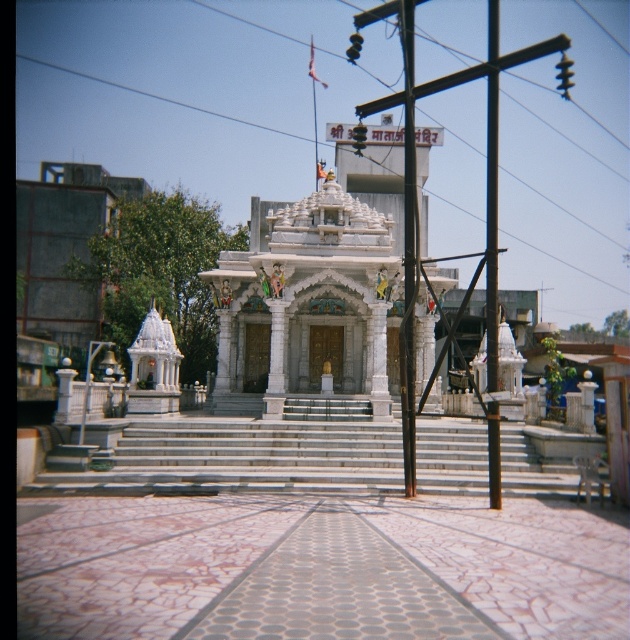
Between black metallic pole at center and metallic pole at center, which one appears on the left side from the viewer's perspective?

black metallic pole at center

Looking at this image, measure the distance between point [410,412] and camera.

Point [410,412] is 236.82 feet away from camera.

This screenshot has height=640, width=630. In order to click on black metallic pole at center in this screenshot , I will do point(408,248).

Who is positioned more to the left, white marble stairs at center or metallic pole at center?

white marble stairs at center is more to the left.

Does white marble stairs at center have a greater width compared to metallic pole at center?

Indeed, white marble stairs at center has a greater width compared to metallic pole at center.

Between point (147, 417) and point (493, 218), which one is positioned in front?

Positioned in front is point (493, 218).

Locate an element on the screen. white marble stairs at center is located at coordinates (238, 458).

Can you confirm if white marble hindu temple at center is bigger than black metallic pole at center?

Yes.

Does white marble hindu temple at center have a lesser width compared to black metallic pole at center?

No.

Identify the location of white marble hindu temple at center. Image resolution: width=630 pixels, height=640 pixels. (307, 305).